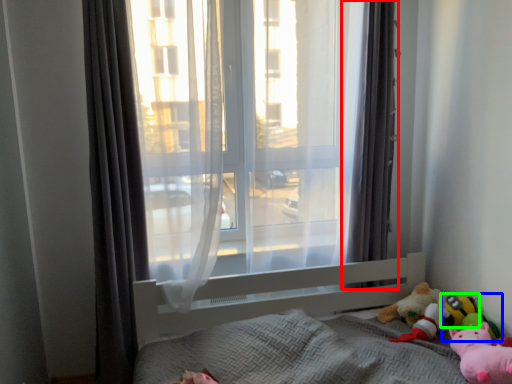
Question: Based on their relative distances, which object is nearer to curtain (highlighted by a red box)? Choose from toy (highlighted by a blue box) and toy (highlighted by a green box).

Choices:
 (A) toy
 (B) toy

Answer: (A)